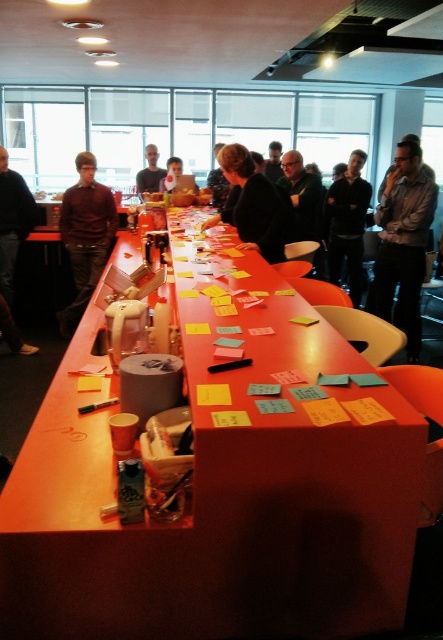
Question: Which object is the farthest from the dark gray shirt at center?

Choices:
 (A) matte plastic laptop at center
 (B) matte brown shirt at left

Answer: (B)

Question: Is matte orange table at center wider than black matte jacket at center?

Choices:
 (A) yes
 (B) no

Answer: (A)

Question: Which object is farther from the camera taking this photo?

Choices:
 (A) matte black shirt at left
 (B) matte orange table at center

Answer: (A)

Question: Which of the following is the farthest from the observer?

Choices:
 (A) matte brown shirt at left
 (B) matte black shirt at left
 (C) matte plastic laptop at center
 (D) dark gray shirt at center

Answer: (D)

Question: Can you confirm if matte gray shirt at upper right is positioned below matte brown shirt at left?

Choices:
 (A) yes
 (B) no

Answer: (A)

Question: Can you confirm if matte gray shirt at upper right is positioned below dark gray shirt at center?

Choices:
 (A) no
 (B) yes

Answer: (B)